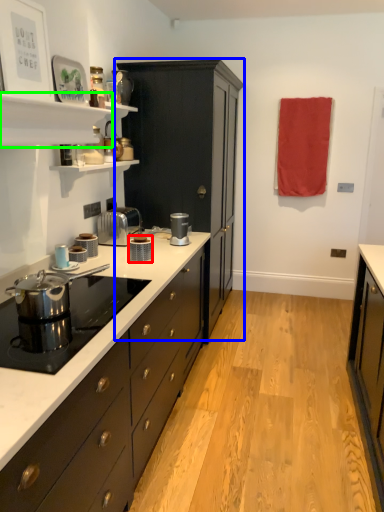
Question: Which is nearer to the kitchen appliance (highlighted by a red box)? cabinetry (highlighted by a blue box) or shelf (highlighted by a green box).

Choices:
 (A) cabinetry
 (B) shelf

Answer: (B)